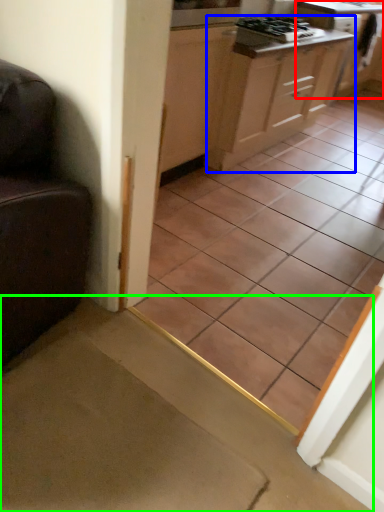
Question: Considering the real-world distances, which object is closest to cabinetry (highlighted by a red box)? cabinetry (highlighted by a blue box) or stairwell (highlighted by a green box).

Choices:
 (A) cabinetry
 (B) stairwell

Answer: (A)